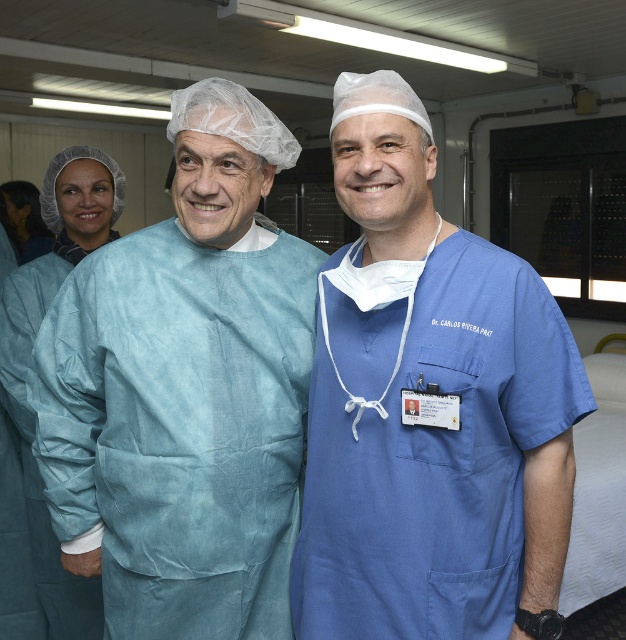
Question: Is blue scrubs at center bigger than blue smooth scrubs at center?

Choices:
 (A) yes
 (B) no

Answer: (B)

Question: Is blue scrubs at center smaller than blue scrubs at left?

Choices:
 (A) yes
 (B) no

Answer: (A)

Question: Considering the real-world distances, which object is farthest from the blue smooth scrubs at center?

Choices:
 (A) blue scrubs at left
 (B) blue scrubs at center

Answer: (A)

Question: Can you confirm if blue scrubs at center is smaller than blue scrubs at left?

Choices:
 (A) no
 (B) yes

Answer: (B)

Question: Among these objects, which one is nearest to the camera?

Choices:
 (A) blue scrubs at left
 (B) blue scrubs at center

Answer: (B)

Question: Which point is farther from the camera taking this photo?

Choices:
 (A) (29, 406)
 (B) (275, 445)

Answer: (A)